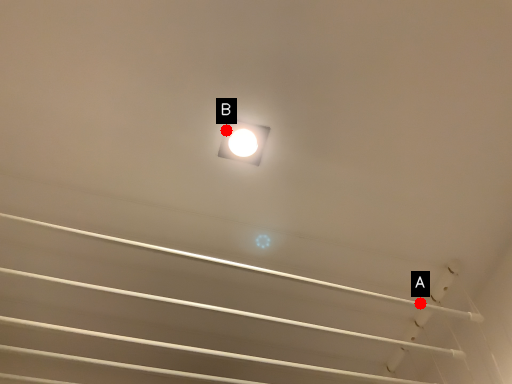
Question: Two points are circled on the image, labeled by A and B beside each circle. Which of the following is the closest to the observer?

Choices:
 (A) A is closer
 (B) B is closer

Answer: (B)